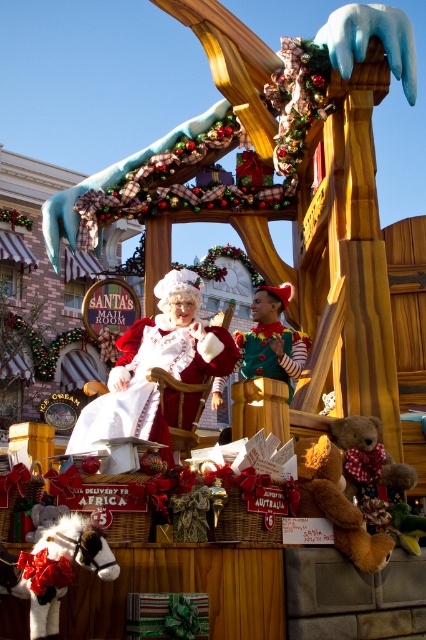
Does fluffy brown teddy bear at center appear on the left side of green felt elf at center?

In fact, fluffy brown teddy bear at center is to the right of green felt elf at center.

From the picture: Is fluffy brown teddy bear at center smaller than green felt elf at center?

Indeed, fluffy brown teddy bear at center has a smaller size compared to green felt elf at center.

Is point (305, 476) closer to viewer compared to point (265, 342)?

Yes, point (305, 476) is closer to viewer.

Locate an element on the screen. fluffy brown teddy bear at center is located at coordinates (336, 502).

Who is more forward, (97, 564) or (370, 536)?

Positioned in front is point (97, 564).

From the picture: Which of these two, white plush horse at lower left or fluffy brown teddy bear at center, stands taller?

white plush horse at lower left is taller.

The height and width of the screenshot is (640, 426). In order to click on white plush horse at lower left in this screenshot , I will do `click(54, 570)`.

Between white plush horse at lower left and soft brown teddy bear at lower right, which one has less height?

white plush horse at lower left

Is point (34, 566) positioned in front of point (371, 486)?

Yes, point (34, 566) is closer to viewer.

This screenshot has height=640, width=426. Identify the location of white plush horse at lower left. (x=54, y=570).